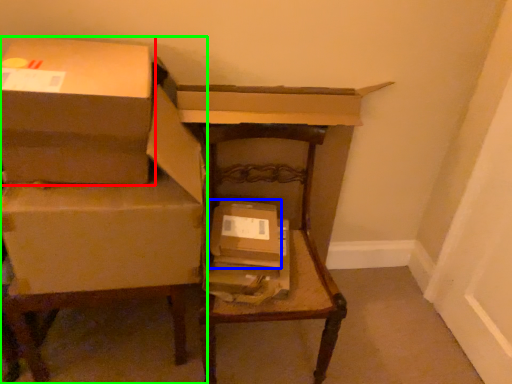
Question: Which object is the closest to the box (highlighted by a red box)? Choose among these: box (highlighted by a blue box) or furniture (highlighted by a green box).

Choices:
 (A) box
 (B) furniture

Answer: (B)